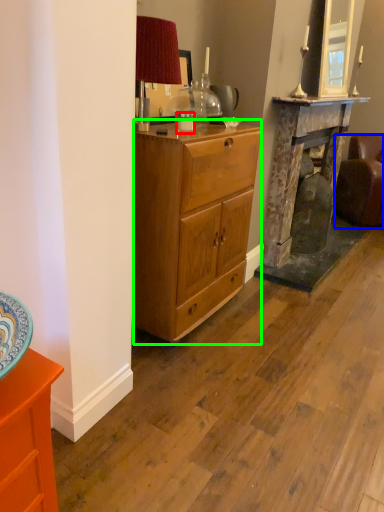
Question: Considering the real-world distances, which object is closest to coffee cup (highlighted by a red box)? studio couch (highlighted by a blue box) or desk (highlighted by a green box).

Choices:
 (A) studio couch
 (B) desk

Answer: (B)